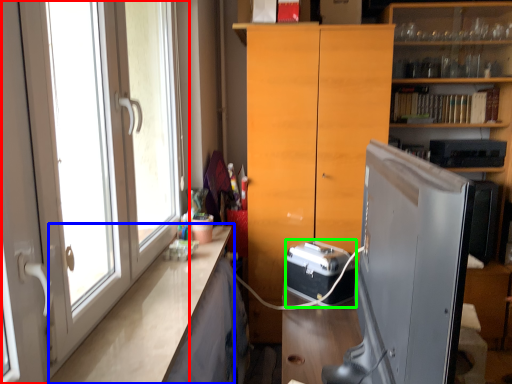
Question: Which is nearer to the door (highlighted by a red box)? counter top (highlighted by a blue box) or appliance (highlighted by a green box).

Choices:
 (A) counter top
 (B) appliance

Answer: (A)